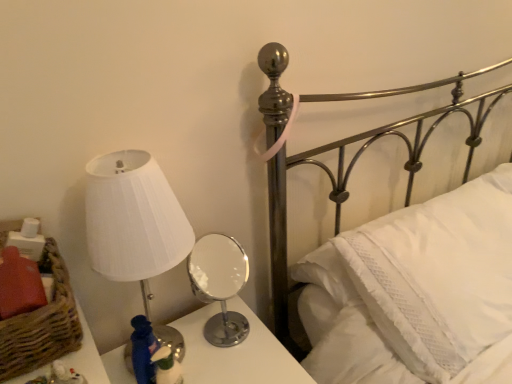
Find the location of a particular element. This screenshot has width=512, height=384. vacant location below white pleated fabric lampshade at left (from a real-world perspective) is located at coordinates (179, 342).